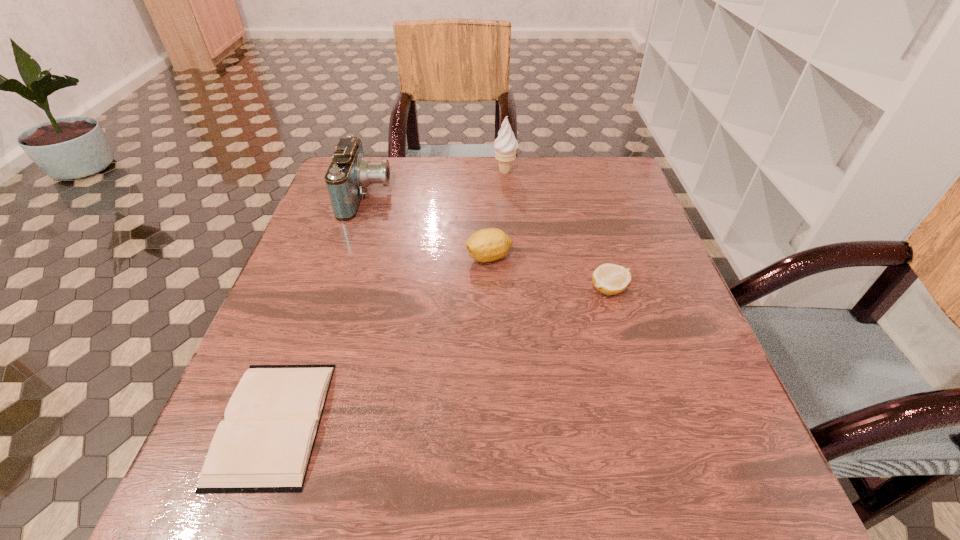
The width and height of the screenshot is (960, 540). Find the location of `free point located at the stem end of the farther lemon`. free point located at the stem end of the farther lemon is located at coordinates (327, 257).

You are a GUI agent. You are given a task and a screenshot of the screen. Output one action in this format:
    pyautogui.click(x=<x>, y=<y>)
    Task: Click on the vacant position located 0.230m at the stem end of the farther lemon
    The image size is (960, 540).
    Given the screenshot: What is the action you would take?
    pyautogui.click(x=364, y=257)

What are the coordinates of `free region located at the stem end of the farther lemon` in the screenshot? It's located at (341, 257).

This screenshot has height=540, width=960. Identify the location of free region located 0.400m on the front of the rightmost object. (677, 517).

You are a GUI agent. You are given a task and a screenshot of the screen. Output one action in this format:
    pyautogui.click(x=<x>, y=<y>)
    Task: Click on the free space located 0.260m on the back of the nearest object
    This screenshot has height=540, width=960.
    Given the screenshot: What is the action you would take?
    pyautogui.click(x=330, y=266)

The width and height of the screenshot is (960, 540). I want to click on icecream located at the far edge, so click(505, 145).

At what (x,y) coordinates should I click in order to perform the action: click on camcorder positioned at the far edge. Please return your answer as a coordinate pair (x, y). This screenshot has height=540, width=960. Looking at the image, I should click on (349, 174).

In order to click on object at the near edge in this screenshot , I will do `click(264, 445)`.

You are a GUI agent. You are given a task and a screenshot of the screen. Output one action in this format:
    pyautogui.click(x=<x>, y=<y>)
    Task: Click on the camcorder situated at the left edge
    This screenshot has width=960, height=540.
    Given the screenshot: What is the action you would take?
    pyautogui.click(x=349, y=174)

I want to click on hardback book that is at the left edge, so click(264, 445).